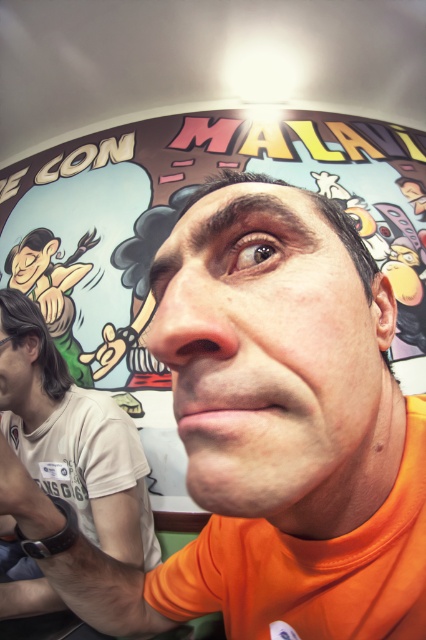
You are an artist analyzing the facial features in the image. Which object is smaller between the pink matte nose at center and the matte black hair at left?

The pink matte nose at center is smaller than the matte black hair at left according to the description.

You are standing in front of the mural and see two points marked in the image. The first point is at coordinates point [204,314] and the second point is at point [0,355]. Which point is closer to you?

Point [204,314] is in front of point [0,355], so the first point is closer to you.

You are a photographer trying to capture the scene. You notice two elements in the image. One is the pink matte lips at center and the other is the matte green face at upper left. Based on their positions, which one is closer to the right edge of the frame?

The pink matte lips at center are to the right of the matte green face at upper left, so the pink matte lips at center are closer to the right edge of the frame.